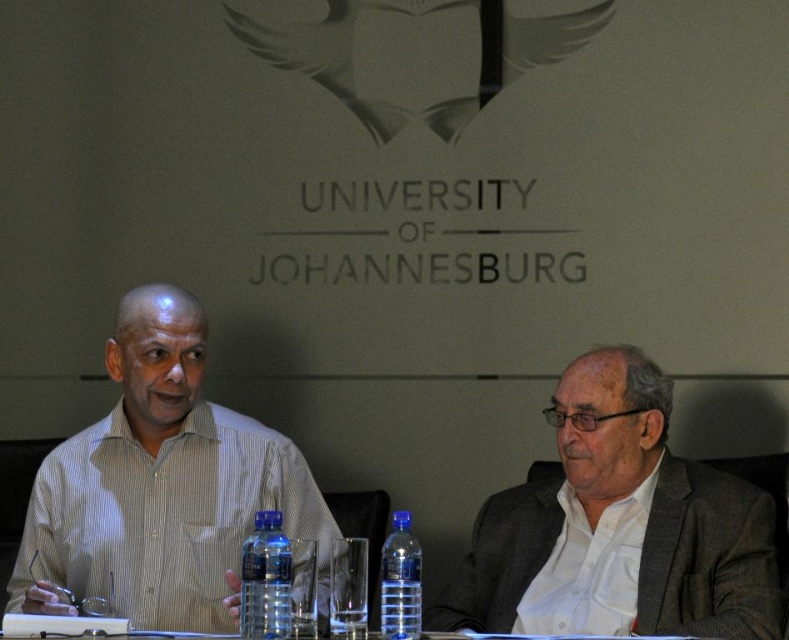
Question: Which of these objects is positioned closest to the transparent plastic bottle at center?

Choices:
 (A) clear plastic bottle at center
 (B) white striped shirt at center

Answer: (A)

Question: Which object is farther from the camera taking this photo?

Choices:
 (A) clear plastic bottle at center
 (B) white textured shirt at center
 (C) white striped shirt at center

Answer: (C)

Question: Which object appears farthest from the camera in this image?

Choices:
 (A) transparent plastic bottle at center
 (B) white textured shirt at center

Answer: (B)

Question: Can you confirm if white striped shirt at center is thinner than transparent plastic bottle at center?

Choices:
 (A) yes
 (B) no

Answer: (B)

Question: Where is white striped shirt at center located in relation to transparent plastic bottle at center in the image?

Choices:
 (A) left
 (B) right

Answer: (A)

Question: Is the position of white textured shirt at center more distant than that of transparent plastic bottle at center?

Choices:
 (A) yes
 (B) no

Answer: (A)